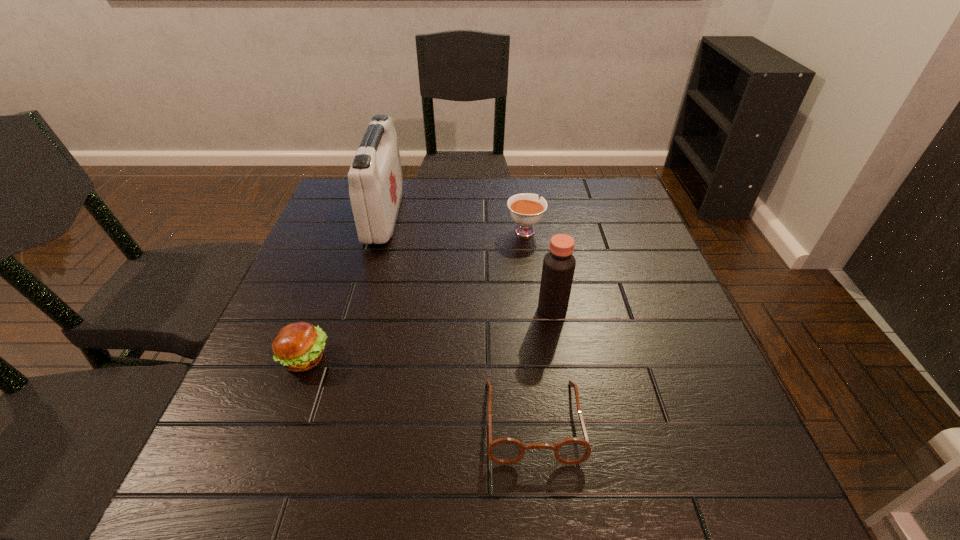
Where is `vacant area that lies between the hamburger and the teacup`? This screenshot has width=960, height=540. vacant area that lies between the hamburger and the teacup is located at coordinates (415, 294).

At what (x,y) coordinates should I click in order to perform the action: click on unoccupied position between the nearest object and the hamburger. Please return your answer as a coordinate pair (x, y). Looking at the image, I should click on [420, 389].

This screenshot has width=960, height=540. In order to click on vacant point located between the hamburger and the nearest object in this screenshot , I will do `click(420, 389)`.

At what (x,y) coordinates should I click in order to perform the action: click on vacant area that lies between the tallest object and the hamburger. Please return your answer as a coordinate pair (x, y). Looking at the image, I should click on (345, 287).

The height and width of the screenshot is (540, 960). I want to click on vacant area between the nearest object and the first-aid kit, so click(459, 318).

Locate which object ranks fourth in proximity to the teacup. Please provide its 2D coordinates. Your answer should be formatted as a tuple, i.e. [(x, y)], where the tuple contains the x and y coordinates of a point satisfying the conditions above.

[(299, 347)]

The height and width of the screenshot is (540, 960). I want to click on the closest object to the hamburger, so click(x=375, y=178).

This screenshot has width=960, height=540. I want to click on vacant region that satisfies the following two spatial constraints: 1. on the front side of the tallest object; 2. on the side of the teacup with the handle, so click(381, 230).